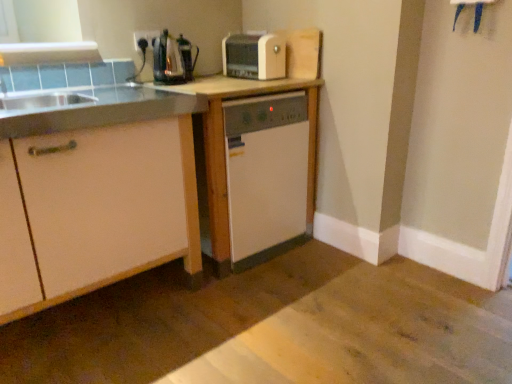
Question: From a real-world perspective, is white matte cabinet at left beneath matte plastic outlet at upper left?

Choices:
 (A) no
 (B) yes

Answer: (B)

Question: Is white matte cabinet at left oriented away from matte plastic outlet at upper left?

Choices:
 (A) no
 (B) yes

Answer: (A)

Question: Can you confirm if white matte cabinet at left is positioned to the left of matte plastic outlet at upper left?

Choices:
 (A) yes
 (B) no

Answer: (A)

Question: Considering the relative sizes of white matte cabinet at left and matte plastic outlet at upper left in the image provided, is white matte cabinet at left taller than matte plastic outlet at upper left?

Choices:
 (A) yes
 (B) no

Answer: (A)

Question: From the image's perspective, would you say white matte cabinet at left is positioned over matte plastic outlet at upper left?

Choices:
 (A) no
 (B) yes

Answer: (A)

Question: Is matte plastic outlet at upper left inside the boundaries of white wood table at center, or outside?

Choices:
 (A) inside
 (B) outside

Answer: (B)

Question: Is point (138, 49) positioned closer to the camera than point (245, 82)?

Choices:
 (A) farther
 (B) closer

Answer: (A)

Question: From the image's perspective, is matte plastic outlet at upper left located above or below white wood table at center?

Choices:
 (A) below
 (B) above

Answer: (B)

Question: In terms of size, does matte plastic outlet at upper left appear bigger or smaller than white wood table at center?

Choices:
 (A) big
 (B) small

Answer: (B)

Question: In the image, is satin silver coffee machine at upper center on the left side or the right side of white plastic toaster at upper center?

Choices:
 (A) right
 (B) left

Answer: (B)

Question: Considering the positions of satin silver coffee machine at upper center and white plastic toaster at upper center in the image, is satin silver coffee machine at upper center wider or thinner than white plastic toaster at upper center?

Choices:
 (A) thin
 (B) wide

Answer: (A)

Question: Is satin silver coffee machine at upper center inside the boundaries of white plastic toaster at upper center, or outside?

Choices:
 (A) outside
 (B) inside

Answer: (A)

Question: Does point (172, 52) appear closer or farther from the camera than point (276, 72)?

Choices:
 (A) farther
 (B) closer

Answer: (B)

Question: From the image's perspective, is satin silver coffee machine at upper center located above or below matte plastic outlet at upper left?

Choices:
 (A) below
 (B) above

Answer: (A)

Question: Is satin silver coffee machine at upper center spatially inside matte plastic outlet at upper left, or outside of it?

Choices:
 (A) inside
 (B) outside

Answer: (B)